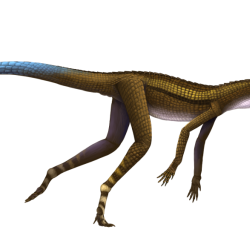
This screenshot has width=250, height=250. Identify the location of light. (158, 114), (172, 117), (244, 105), (248, 101).